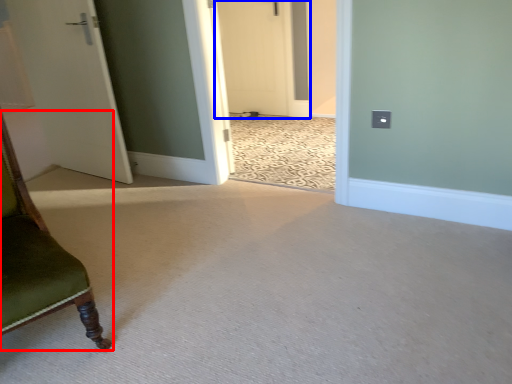
Question: Which of the following is the farthest to the observer, furniture (highlighted by a red box) or door (highlighted by a blue box)?

Choices:
 (A) furniture
 (B) door

Answer: (B)